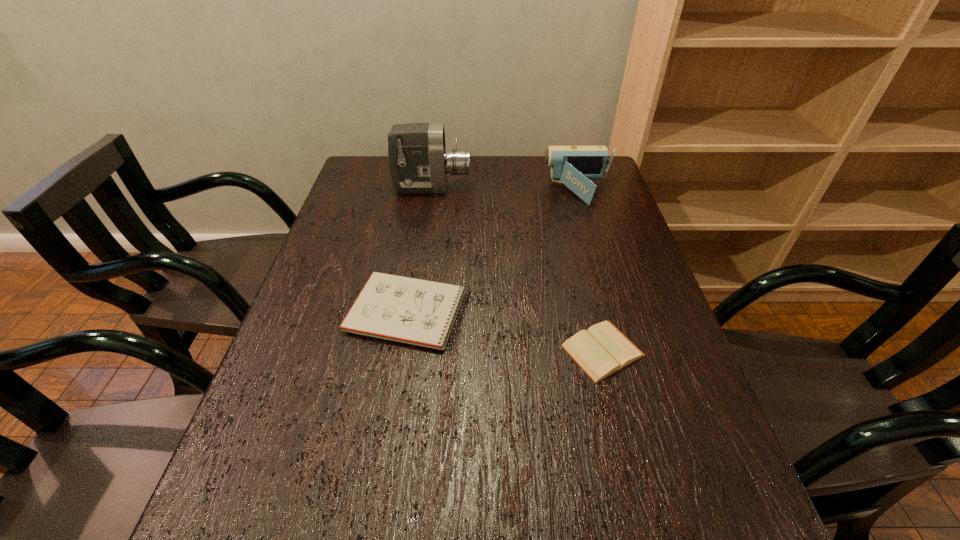
The height and width of the screenshot is (540, 960). In order to click on the left camcorder in this screenshot , I will do `click(418, 161)`.

At what (x,y) coordinates should I click in order to perform the action: click on the tallest object. Please return your answer as a coordinate pair (x, y). Image resolution: width=960 pixels, height=540 pixels. Looking at the image, I should click on (418, 161).

I want to click on the third shortest object, so click(x=573, y=166).

Locate an element on the screen. The width and height of the screenshot is (960, 540). the shorter camcorder is located at coordinates (573, 166).

Locate an element on the screen. the second shortest object is located at coordinates (415, 311).

I want to click on diary, so pyautogui.click(x=600, y=351).

You are a GUI agent. You are given a task and a screenshot of the screen. Output one action in this format:
    pyautogui.click(x=<x>, y=<y>)
    Task: Click on the vacant region located at the front of the left camcorder, highlighting the lens
    
    Given the screenshot: What is the action you would take?
    pyautogui.click(x=537, y=188)

Identify the location of free space located on the side of the second tallest object with the flip-out screen. (499, 192).

Locate an element on the screen. The width and height of the screenshot is (960, 540). vacant area located on the side of the second tallest object with the flip-out screen is located at coordinates click(x=496, y=192).

Where is `free space located on the side of the second tallest object with the flip-out screen`? free space located on the side of the second tallest object with the flip-out screen is located at coordinates (454, 192).